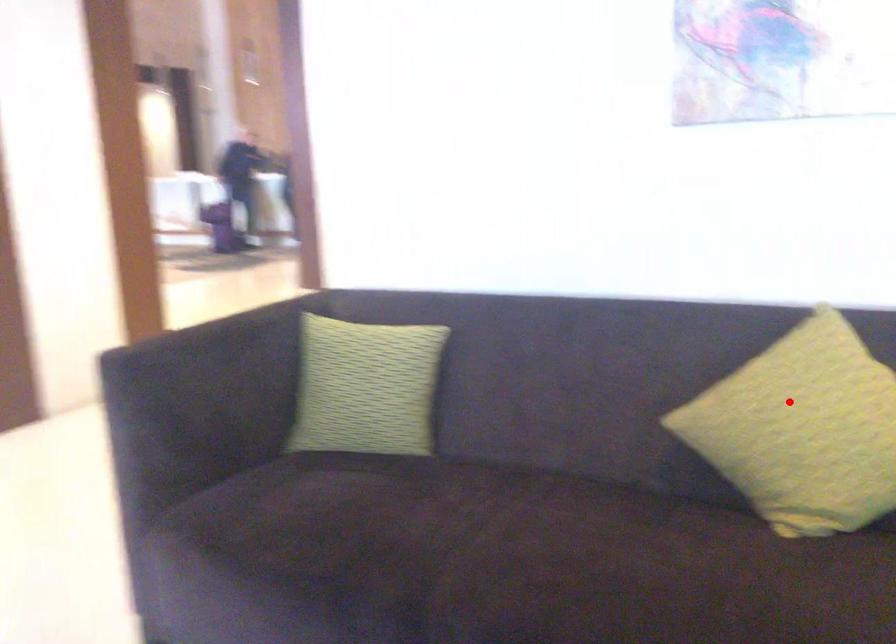
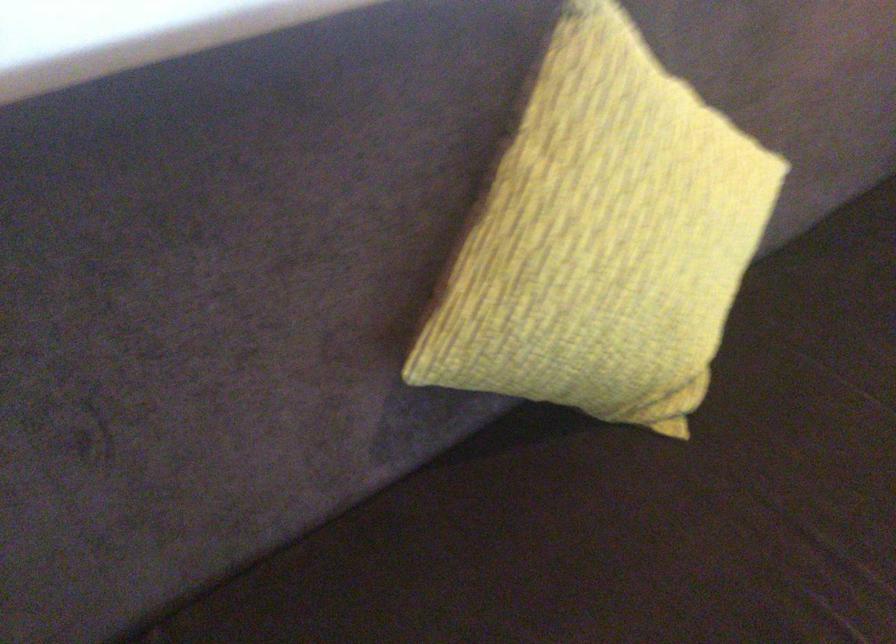
In the second image, find the point that corresponds to the highlighted location in the first image.

(602, 237)